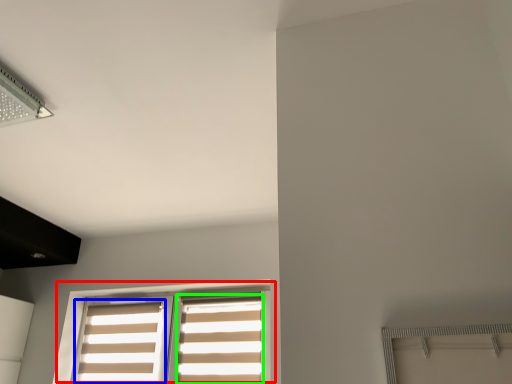
Question: Which object is the farthest from window (highlighted by a red box)? Choose among these: curtain (highlighted by a blue box) or curtain (highlighted by a green box).

Choices:
 (A) curtain
 (B) curtain

Answer: (B)